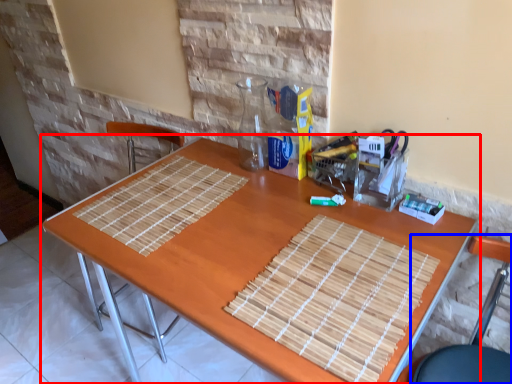
Question: Which object is further to the camera taking this photo, table (highlighted by a red box) or chair (highlighted by a blue box)?

Choices:
 (A) table
 (B) chair

Answer: (A)